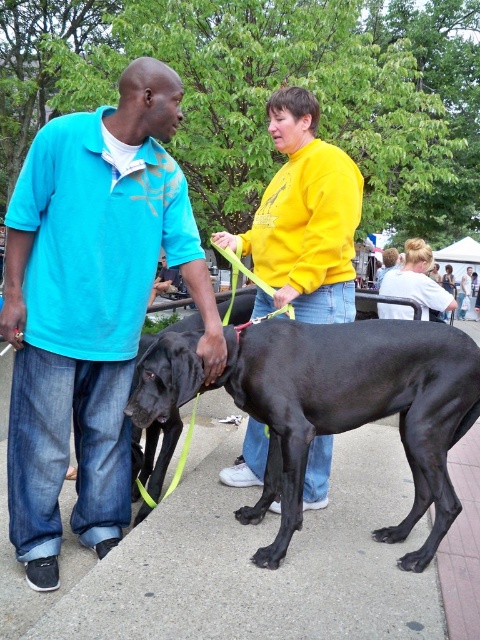
Can you confirm if yellow matte shirt at center is positioned to the right of light blue denim jeans at center?

No, yellow matte shirt at center is not to the right of light blue denim jeans at center.

This screenshot has width=480, height=640. I want to click on yellow matte shirt at center, so click(303, 218).

Is black smooth dog at center taller than light blue denim jeans at center?

Correct, black smooth dog at center is much taller as light blue denim jeans at center.

Which of these two, black smooth dog at center or light blue denim jeans at center, stands taller?

black smooth dog at center

Is point (287, 419) in front of point (451, 296)?

Yes, point (287, 419) is in front of point (451, 296).

At what (x,y) coordinates should I click in order to perform the action: click on black smooth dog at center. Please return your answer as a coordinate pair (x, y). Looking at the image, I should click on (354, 408).

Measure the distance between point (152, 170) and camera.

Point (152, 170) is 2.51 meters from camera.

Is matte blue shirt at center taller than black smooth dog at center?

Yes.

Find the location of a particular element. This screenshot has width=480, height=640. matte blue shirt at center is located at coordinates (91, 307).